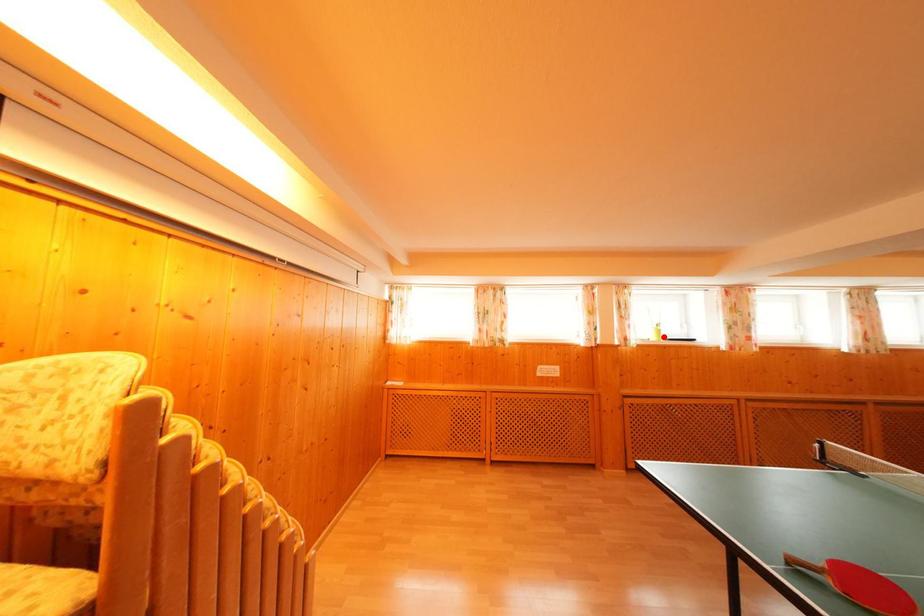
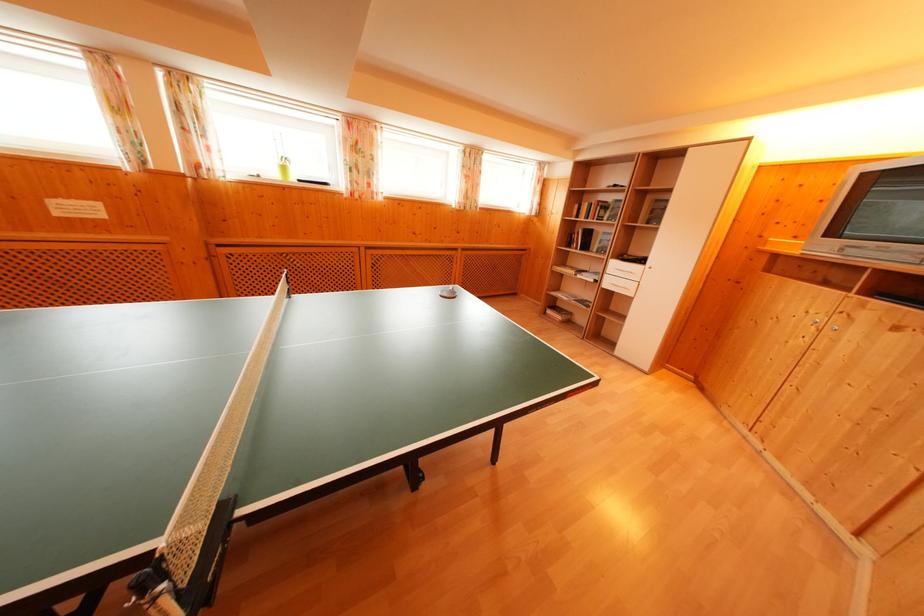
Find the pixel in the second image that matches the highlighted location in the first image.

(288, 174)